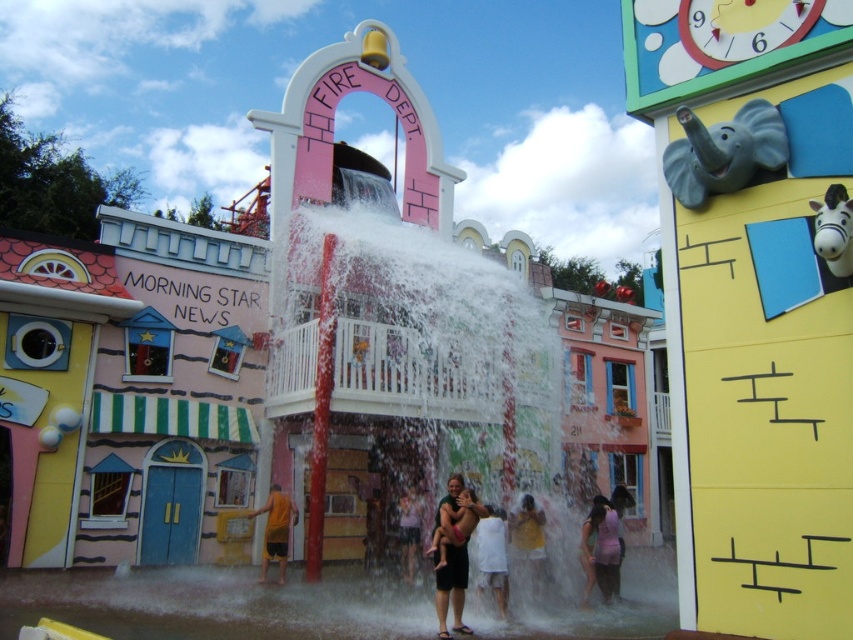
Which of these two, clear water at lower center or orange matte shorts at center, stands taller?

clear water at lower center is taller.

Is clear water at lower center further to the viewer compared to orange matte shorts at center?

No, it is in front of orange matte shorts at center.

This screenshot has height=640, width=853. I want to click on clear water at lower center, so click(x=212, y=605).

Identify the location of clear water at lower center. (212, 605).

Between pink fabric dress at lower center and orange matte shorts at center, which one is positioned lower?

pink fabric dress at lower center is below.

What are the coordinates of `pink fabric dress at lower center` in the screenshot? It's located at pyautogui.click(x=602, y=547).

Is point (212, 627) in front of point (532, 547)?

Yes.

Is the position of clear water at lower center more distant than that of yellow matte shirt at lower center?

No, clear water at lower center is in front of yellow matte shirt at lower center.

I want to click on clear water at lower center, so click(x=212, y=605).

Locate an element on the screen. This screenshot has width=853, height=640. clear water at lower center is located at coordinates (212, 605).